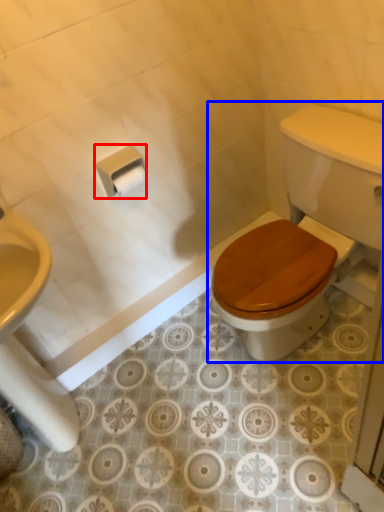
Question: Which object appears farthest to the camera in this image, toilet paper (highlighted by a red box) or toilet (highlighted by a blue box)?

Choices:
 (A) toilet paper
 (B) toilet

Answer: (A)